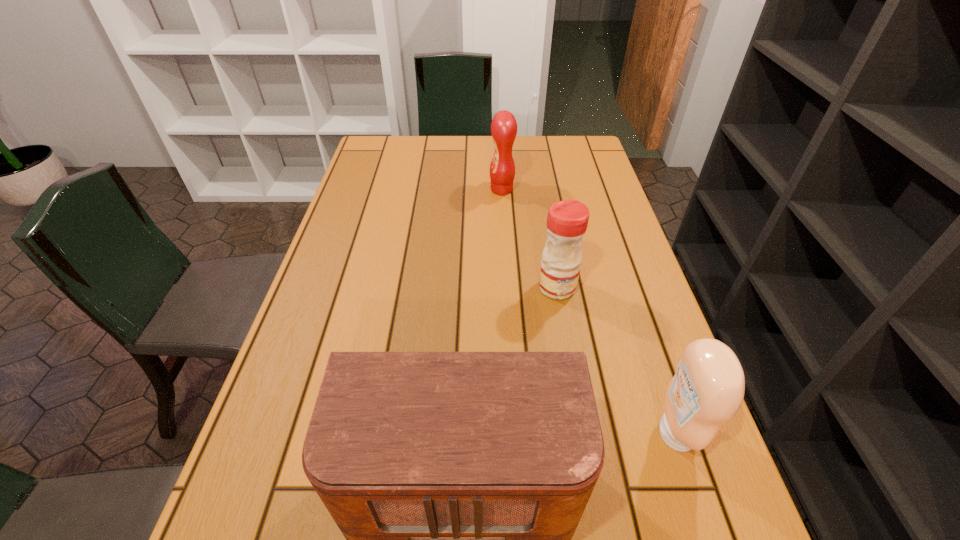
Where is `free space between the leftmost condiment and the nearest condiment`? The width and height of the screenshot is (960, 540). free space between the leftmost condiment and the nearest condiment is located at coordinates (588, 312).

At what (x,y) coordinates should I click in order to perform the action: click on empty location between the second farthest object and the rightmost object. Please return your answer as a coordinate pair (x, y). The height and width of the screenshot is (540, 960). Looking at the image, I should click on (616, 360).

Identify the location of vacant area that lies between the second condiment from left to right and the leftmost condiment. The width and height of the screenshot is (960, 540). (529, 239).

I want to click on free space between the rightmost condiment and the second condiment from left to right, so click(616, 360).

Where is `empty space between the rightmost condiment and the second farthest condiment`? The width and height of the screenshot is (960, 540). empty space between the rightmost condiment and the second farthest condiment is located at coordinates (616, 360).

The height and width of the screenshot is (540, 960). What are the coordinates of `the third closest object to the second condiment from left to right` in the screenshot? It's located at (504, 126).

The height and width of the screenshot is (540, 960). What are the coordinates of `object that stands as the second closest to the radio receiver` in the screenshot? It's located at (567, 221).

Identify the location of condiment that is the second closest to the second farthest condiment. This screenshot has width=960, height=540. [504, 126].

At what (x,y) coordinates should I click in order to perform the action: click on the second closest condiment to the nearest condiment. Please return your answer as a coordinate pair (x, y). This screenshot has height=540, width=960. Looking at the image, I should click on [504, 126].

You are a GUI agent. You are given a task and a screenshot of the screen. Output one action in this format:
    pyautogui.click(x=<x>, y=<y>)
    Task: Click on the free space that satisfies the following two spatial constraints: 1. on the label side of the leftmost condiment; 2. on the left side of the third nearest object
    This screenshot has height=540, width=960.
    Given the screenshot: What is the action you would take?
    pyautogui.click(x=508, y=287)